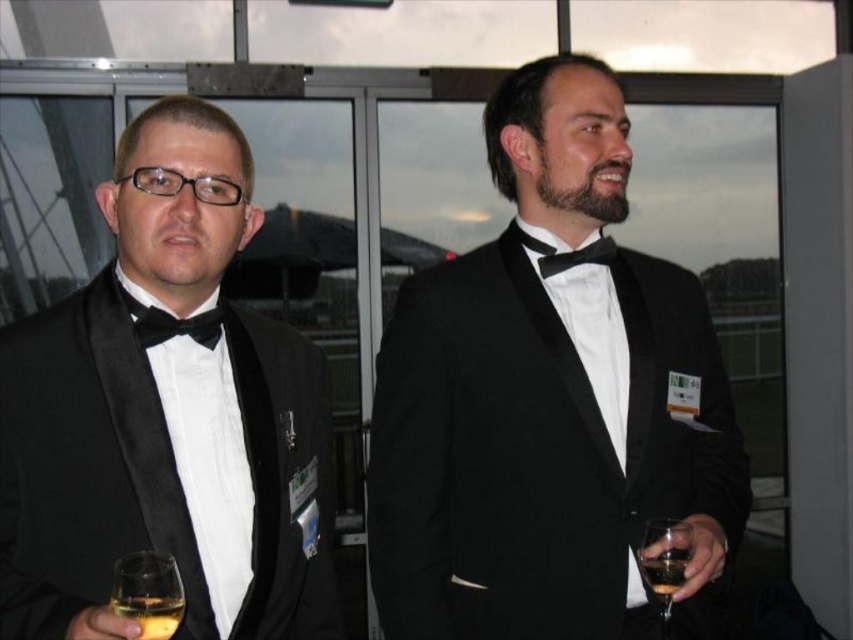
Is point (489, 515) positioned in front of point (134, 604)?

That is False.

Does black satin tuxedo at center appear on the left side of translucent glass wine at left?

In fact, black satin tuxedo at center is to the right of translucent glass wine at left.

Measure the distance between black satin tuxedo at center and camera.

The distance of black satin tuxedo at center from camera is 4.09 feet.

Where is `black satin tuxedo at center`? black satin tuxedo at center is located at coordinates (548, 403).

Can you confirm if translucent glass wine at right is thinner than black satin bow tie at center?

Correct, translucent glass wine at right's width is less than black satin bow tie at center's.

Can you confirm if translucent glass wine at right is taller than black satin bow tie at center?

Yes.

Locate an element on the screen. The image size is (853, 640). translucent glass wine at right is located at coordinates (664, 563).

Where is `translucent glass wine at right`? This screenshot has width=853, height=640. translucent glass wine at right is located at coordinates 664,563.

Who is shorter, translucent glass wine at right or translucent glass wine at center?

Standing shorter between the two is translucent glass wine at center.

Who is lower down, translucent glass wine at right or translucent glass wine at center?

translucent glass wine at right is lower down.

Is point (668, 547) more distant than point (151, 621)?

Yes, point (668, 547) is behind point (151, 621).

You are a GUI agent. You are given a task and a screenshot of the screen. Output one action in this format:
    pyautogui.click(x=<x>, y=<y>)
    Task: Click on the translucent glass wine at right
    This screenshot has height=640, width=853.
    Given the screenshot: What is the action you would take?
    pyautogui.click(x=664, y=563)